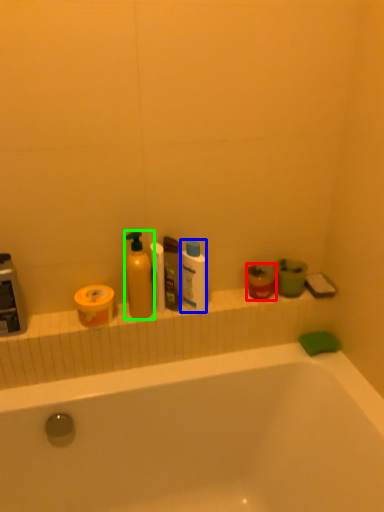
Question: Based on their relative distances, which object is farther from mouthwash (highlighted by a red box)? Choose from cleaning product (highlighted by a blue box) and cleaning product (highlighted by a green box).

Choices:
 (A) cleaning product
 (B) cleaning product

Answer: (B)